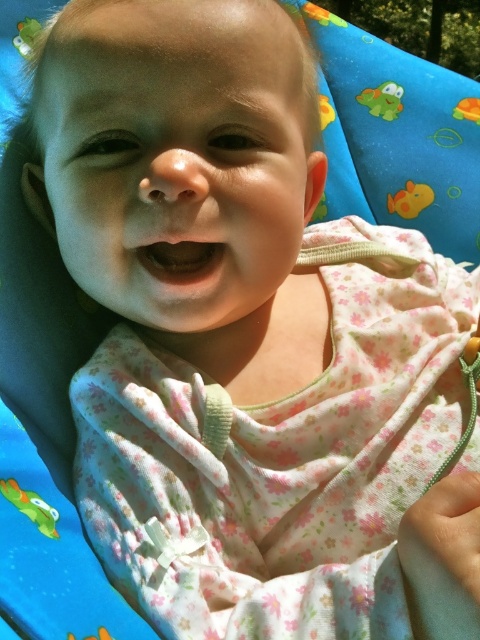
You are a photographer taking a picture of the baby. You need to ensure the pink fabric mouth at center and the green plastic frog at upper left are both visible in the frame. Based on their positions, which object is closer to the bottom of the image?

The pink fabric mouth at center is positioned under the green plastic frog at upper left, so the pink fabric mouth at center is closer to the bottom of the image.

You are a photographer taking a close up of a baby. The baby is wearing a light pink outfit with floral patterns. You notice a point at coordinate (409,198). What object is located at that coordinate?

The point at coordinate (409,198) corresponds to the yellow rubber duck at upper right.